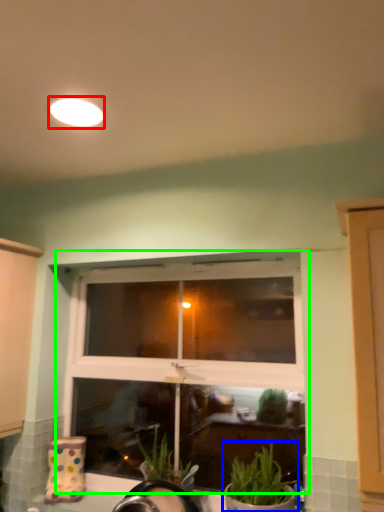
Question: Which object is the farthest from lighting (highlighted by a red box)? Choose among these: houseplant (highlighted by a blue box) or window (highlighted by a green box).

Choices:
 (A) houseplant
 (B) window

Answer: (A)